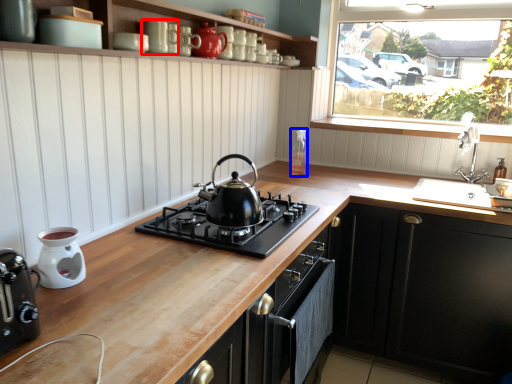
Question: Among these objects, which one is nearest to the camera, appliance (highlighted by a red box) or appliance (highlighted by a blue box)?

Choices:
 (A) appliance
 (B) appliance

Answer: (A)